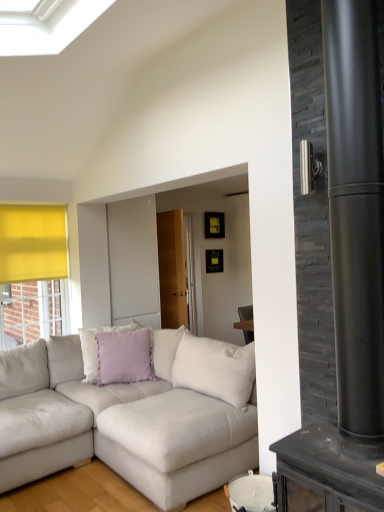
Question: Is light gray fabric couch at lower left thinner than matte black fireplace at right?

Choices:
 (A) no
 (B) yes

Answer: (A)

Question: Does light gray fabric couch at lower left touch matte black fireplace at right?

Choices:
 (A) no
 (B) yes

Answer: (A)

Question: From a real-world perspective, does light gray fabric couch at lower left sit lower than matte black fireplace at right?

Choices:
 (A) yes
 (B) no

Answer: (A)

Question: Considering the relative sizes of light gray fabric couch at lower left and matte black fireplace at right in the image provided, is light gray fabric couch at lower left smaller than matte black fireplace at right?

Choices:
 (A) yes
 (B) no

Answer: (B)

Question: Does light gray fabric couch at lower left have a larger size compared to matte black fireplace at right?

Choices:
 (A) no
 (B) yes

Answer: (B)

Question: From a real-world perspective, is light gray fabric couch at lower left physically above matte black fireplace at right?

Choices:
 (A) yes
 (B) no

Answer: (B)

Question: Is lavender fabric pillow at center facing away from matte black fireplace at right?

Choices:
 (A) no
 (B) yes

Answer: (A)

Question: Is matte black fireplace at right completely or partially inside lavender fabric pillow at center?

Choices:
 (A) no
 (B) yes

Answer: (A)

Question: Can we say lavender fabric pillow at center lies outside matte black fireplace at right?

Choices:
 (A) yes
 (B) no

Answer: (A)

Question: Is lavender fabric pillow at center touching matte black fireplace at right?

Choices:
 (A) no
 (B) yes

Answer: (A)

Question: Is lavender fabric pillow at center far from matte black fireplace at right?

Choices:
 (A) yes
 (B) no

Answer: (A)

Question: From the image's perspective, would you say lavender fabric pillow at center is positioned over matte black fireplace at right?

Choices:
 (A) no
 (B) yes

Answer: (A)

Question: Does matte black fireplace at right have a smaller size compared to light gray fabric couch at lower left?

Choices:
 (A) no
 (B) yes

Answer: (B)